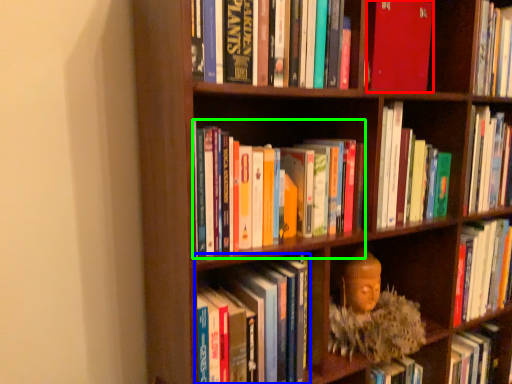
Question: Estimate the real-world distances between objects in this image. Which object is closer to book (highlighted by a red box), book (highlighted by a blue box) or book (highlighted by a green box)?

Choices:
 (A) book
 (B) book

Answer: (B)